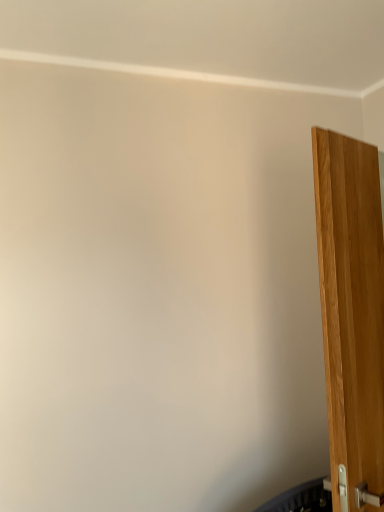
The image size is (384, 512). Describe the element at coordinates (351, 310) in the screenshot. I see `natural wood door at right` at that location.

The image size is (384, 512). Identify the location of natural wood door at right. (351, 310).

You are a GUI agent. You are given a task and a screenshot of the screen. Output one action in this format:
    pyautogui.click(x=<x>, y=<y>)
    Task: Click on the natural wood door at right
    
    Given the screenshot: What is the action you would take?
    pyautogui.click(x=351, y=310)